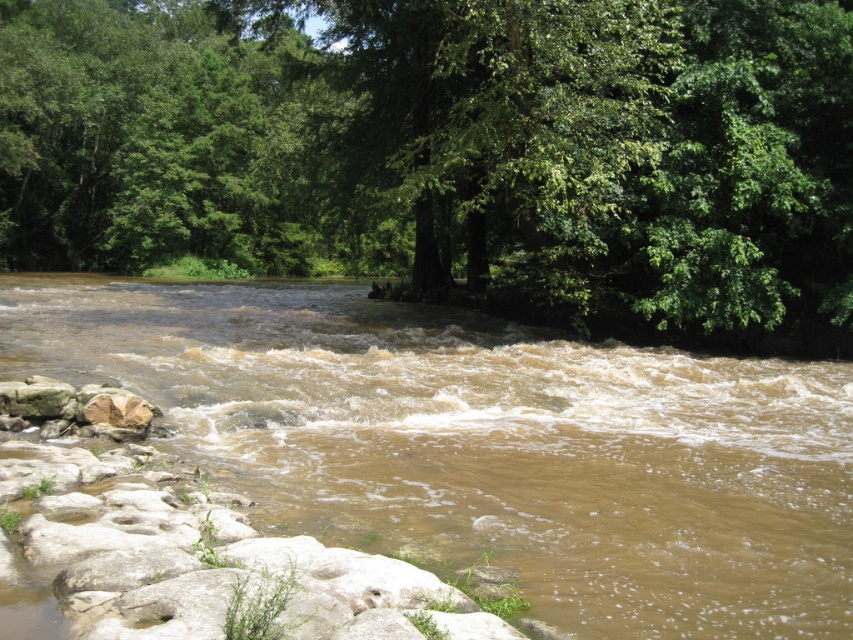
You are planning to set up a small tent for a camping trip. You have two options for locations near the river. One is under the green leafy tree at upper center, and the other is near the brown muddy water at center. Considering the height of the objects, which location would provide more overhead space for your tent?

The green leafy tree at upper center has a greater height compared to the brown muddy water at center, so setting up the tent under the green leafy tree at upper center would provide more overhead space due to its taller structure.

You are a kayaker preparing to navigate the river shown in the image. You see the brown muddy water at center and the brown rough rock at lower left. Which object is closer to your current position as you paddle along the river?

The brown muddy water at center is closer to your current position because it is in front of the brown rough rock at lower left, indicating it is nearer to you as you paddle.

You are a hiker who wants to cross the river using a 20 meter long rope bridge. You see the green leafy tree at upper center and the brown muddy water at center. Can you safely cross the river using the bridge?

The distance between the green leafy tree at upper center and the brown muddy water at center is 21.83 meters. Since the rope bridge is only 20 meters long, it would not be long enough to span the gap between them. Therefore, you cannot safely cross the river using the bridge.